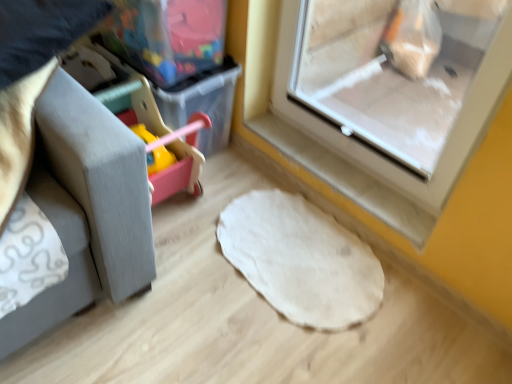
Locate an element on the screen. The width and height of the screenshot is (512, 384). free region under white felt mat at center (from a real-world perspective) is located at coordinates (298, 251).